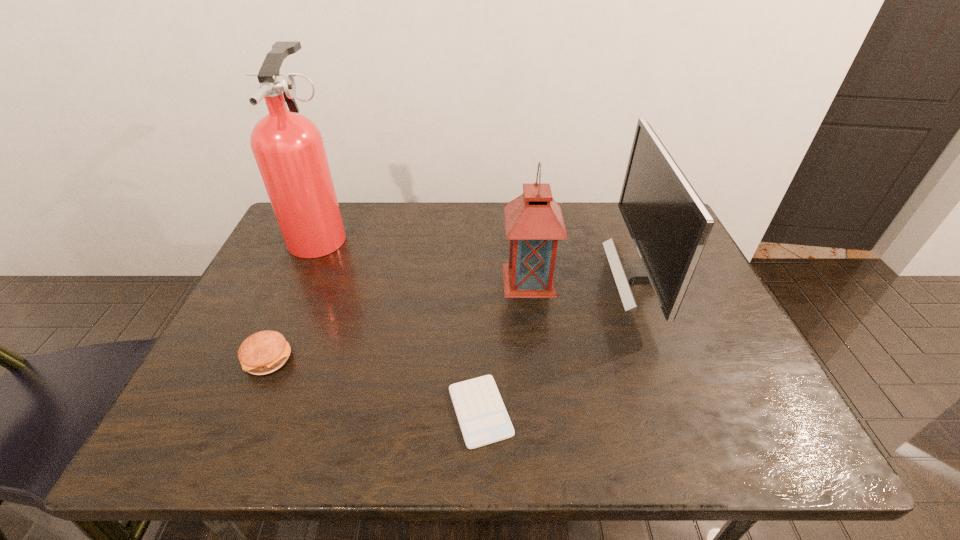
What are the coordinates of `vacant position at the far edge of the desktop` in the screenshot? It's located at (463, 210).

The image size is (960, 540). In the image, there is a desktop. In order to click on vacant space at the near edge in this screenshot , I will do `click(432, 451)`.

Locate an element on the screen. The height and width of the screenshot is (540, 960). free location at the left edge of the desktop is located at coordinates (253, 334).

You are a GUI agent. You are given a task and a screenshot of the screen. Output one action in this format:
    pyautogui.click(x=<x>, y=<y>)
    Task: Click on the free space at the right edge
    The image size is (960, 540).
    Given the screenshot: What is the action you would take?
    pyautogui.click(x=698, y=268)

This screenshot has width=960, height=540. I want to click on free point at the near left corner, so click(x=189, y=446).

What are the coordinates of `vacant space at the far right corner of the desktop` in the screenshot? It's located at (629, 234).

This screenshot has width=960, height=540. I want to click on empty space between the rightmost object and the tallest object, so click(481, 254).

Identify the location of free space between the monitor and the fire extinguisher. Image resolution: width=960 pixels, height=540 pixels. (481, 254).

In order to click on free area in between the fourth tallest object and the fire extinguisher in this screenshot , I will do pyautogui.click(x=295, y=296).

Find the location of a particular element. The image size is (960, 540). vacant area between the shortest object and the tallest object is located at coordinates (400, 322).